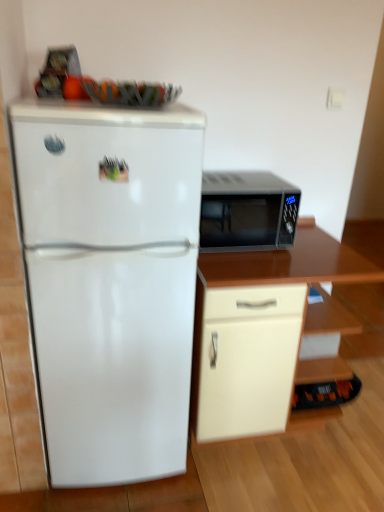
Question: Is matte black microwave at right behind beige matte cabinet at lower right?

Choices:
 (A) yes
 (B) no

Answer: (A)

Question: Is matte black microwave at right thinner than beige matte cabinet at lower right?

Choices:
 (A) no
 (B) yes

Answer: (B)

Question: Can you confirm if matte black microwave at right is bigger than beige matte cabinet at lower right?

Choices:
 (A) no
 (B) yes

Answer: (A)

Question: Is matte black microwave at right smaller than beige matte cabinet at lower right?

Choices:
 (A) no
 (B) yes

Answer: (B)

Question: From a real-world perspective, is matte black microwave at right located beneath beige matte cabinet at lower right?

Choices:
 (A) yes
 (B) no

Answer: (B)

Question: Looking at their shapes, would you say white glossy refrigerator at left is wider or thinner than matte black microwave at right?

Choices:
 (A) wide
 (B) thin

Answer: (A)

Question: From their relative heights in the image, would you say white glossy refrigerator at left is taller or shorter than matte black microwave at right?

Choices:
 (A) short
 (B) tall

Answer: (B)

Question: Visually, is white glossy refrigerator at left positioned to the left or to the right of matte black microwave at right?

Choices:
 (A) left
 (B) right

Answer: (A)

Question: From a real-world perspective, is white glossy refrigerator at left physically located above or below matte black microwave at right?

Choices:
 (A) above
 (B) below

Answer: (B)

Question: Is matte black microwave at right situated inside white glossy refrigerator at left or outside?

Choices:
 (A) inside
 (B) outside

Answer: (B)

Question: Visually, is matte black microwave at right positioned to the left or to the right of white glossy refrigerator at left?

Choices:
 (A) right
 (B) left

Answer: (A)

Question: From a real-world perspective, is matte black microwave at right positioned above or below white glossy refrigerator at left?

Choices:
 (A) below
 (B) above

Answer: (B)

Question: Is matte black microwave at right wider or thinner than white glossy refrigerator at left?

Choices:
 (A) wide
 (B) thin

Answer: (B)

Question: From a real-world perspective, is white glossy refrigerator at left above or below beige matte cabinet at lower right?

Choices:
 (A) above
 (B) below

Answer: (A)

Question: Is white glossy refrigerator at left inside the boundaries of beige matte cabinet at lower right, or outside?

Choices:
 (A) inside
 (B) outside

Answer: (B)